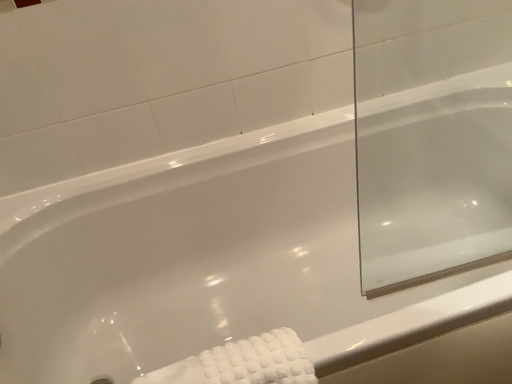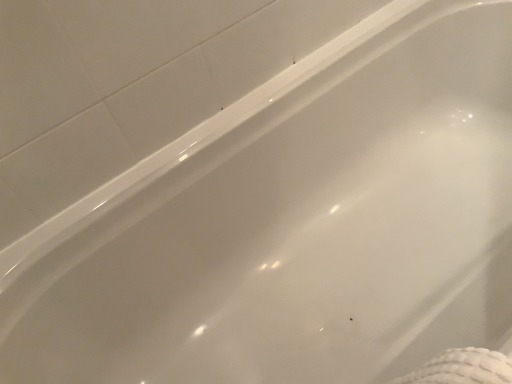
Question: How did the camera likely rotate when shooting the video?

Choices:
 (A) rotated left
 (B) rotated right

Answer: (B)